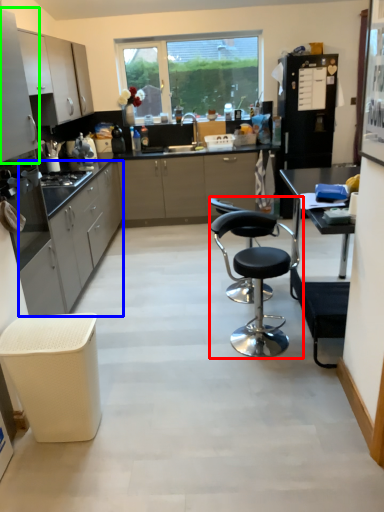
Question: Estimate the real-world distances between objects in this image. Which object is farther from chair (highlighted by a red box), cabinetry (highlighted by a blue box) or cabinetry (highlighted by a green box)?

Choices:
 (A) cabinetry
 (B) cabinetry

Answer: (B)